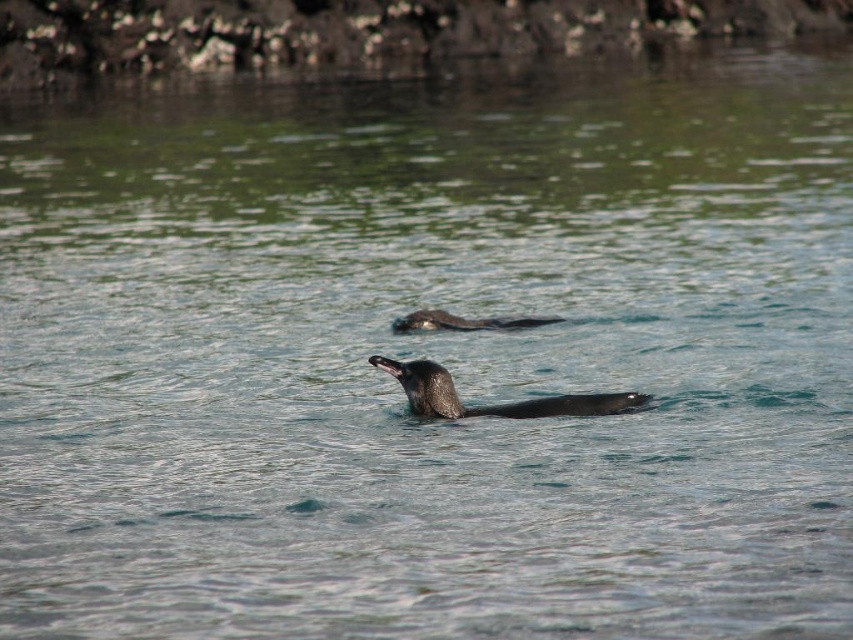
This screenshot has width=853, height=640. Describe the element at coordinates (492, 404) in the screenshot. I see `shiny black otter at center` at that location.

Who is more forward, (x=408, y=392) or (x=469, y=321)?

Positioned in front is point (x=408, y=392).

Does point (625, 403) come farther from viewer compared to point (548, 323)?

No.

Identify the location of shiny black otter at center. (492, 404).